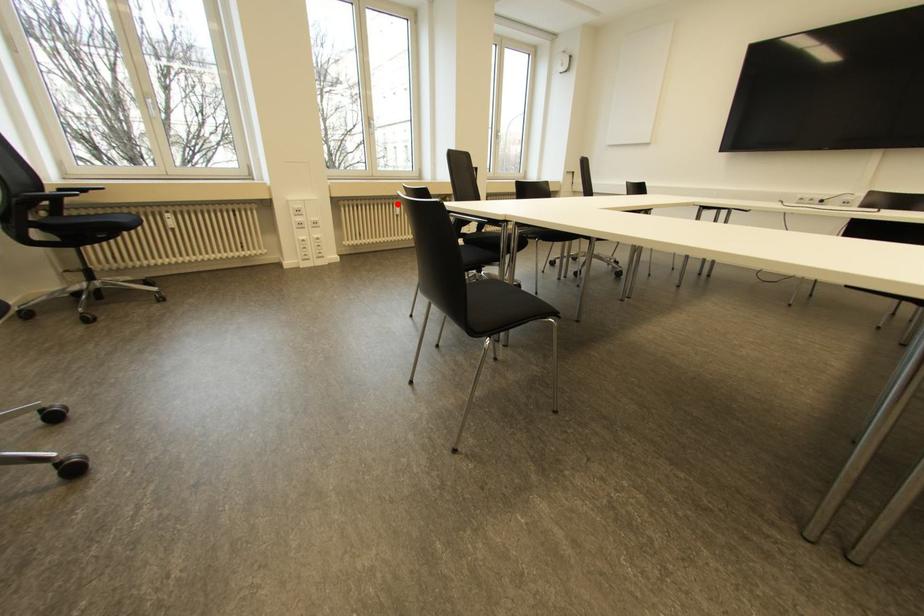
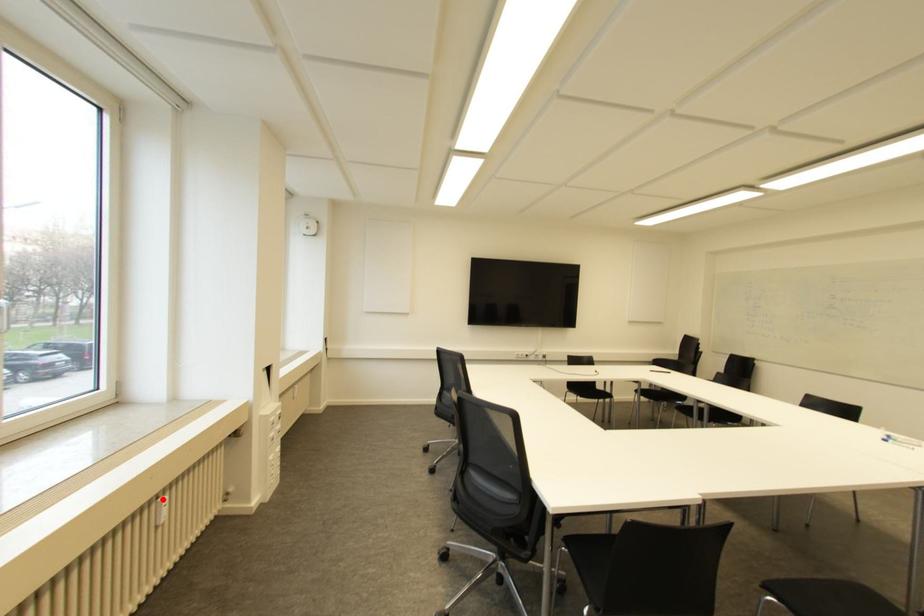
I am providing you with two images of the same scene from different viewpoints. A red point is marked on the first image and another point is marked on the second image. Do the highlighted points in image1 and image2 indicate the same real-world spot?

Yes